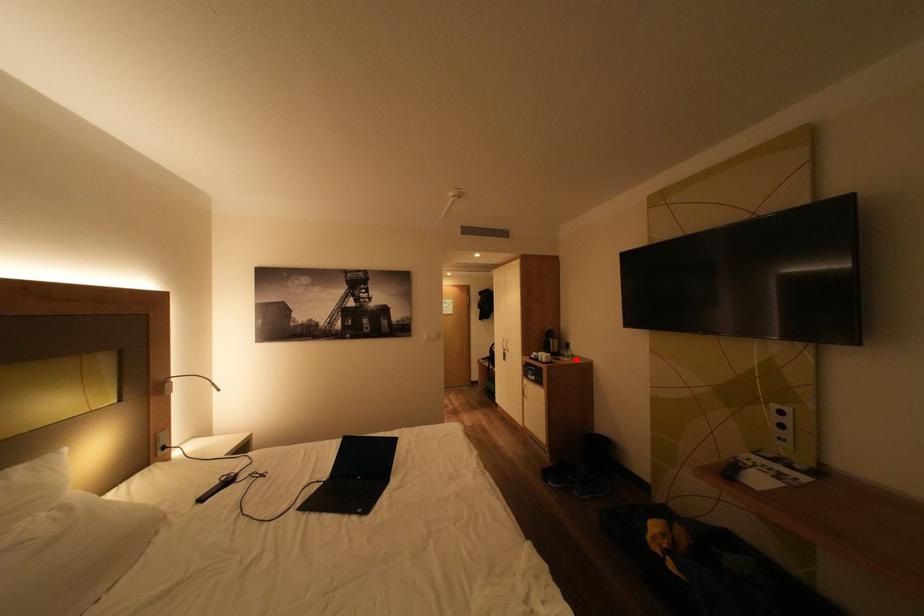
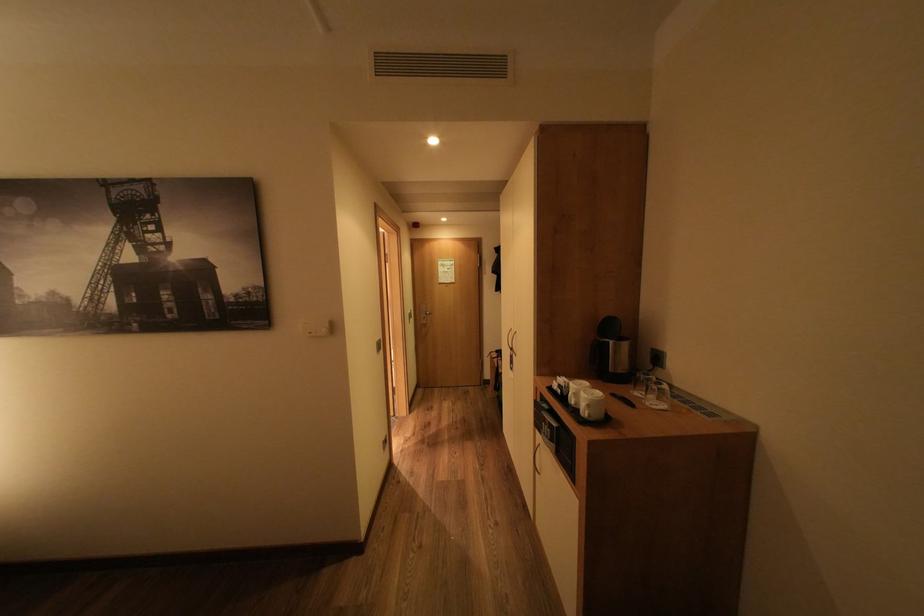
Where in the second image is the point corresponding to the highlighted location from the first image?

(664, 402)